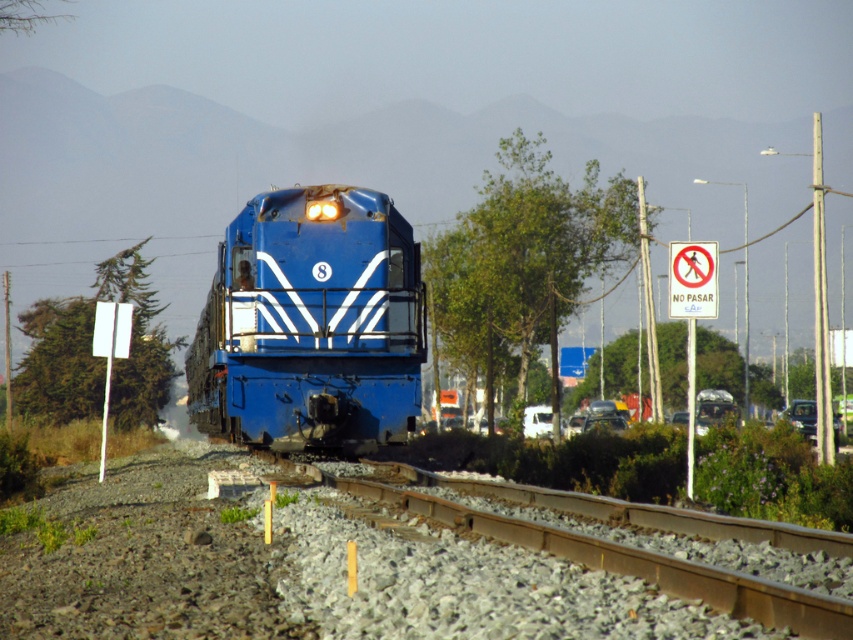
You are a pedestrian standing at the center of the scene. You see the rusty metal train track at center and the white matte van at center. Which object is directly above the other?

The rusty metal train track at center is positioned over the white matte van at center, meaning the train track is directly above the van.

You are standing at the origin point of the coordinate system. The blue glossy locomotive at center is approaching you. Can you determine its current position in the coordinate system?

The blue glossy locomotive at center is currently at position point (311, 324) in the coordinate system.

You are standing on the railway track and see the blue glossy locomotive at center approaching you. The train is moving at 30 mph. How many seconds do you have before the train reaches you?

The blue glossy locomotive at center is 71.74 feet away. At 30 mph, the train travels 44 feet per second. Dividing 71.74 by 44 gives approximately 1.63 seconds. Therefore, you have about 1.63 seconds before the train reaches you.